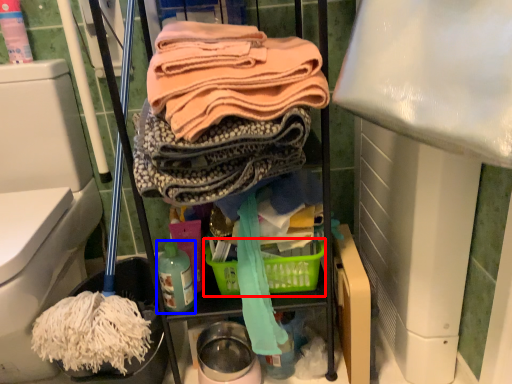
Question: Which of the following is the farthest to the observer, basket (highlighted by a red box) or bottle (highlighted by a blue box)?

Choices:
 (A) basket
 (B) bottle

Answer: (A)